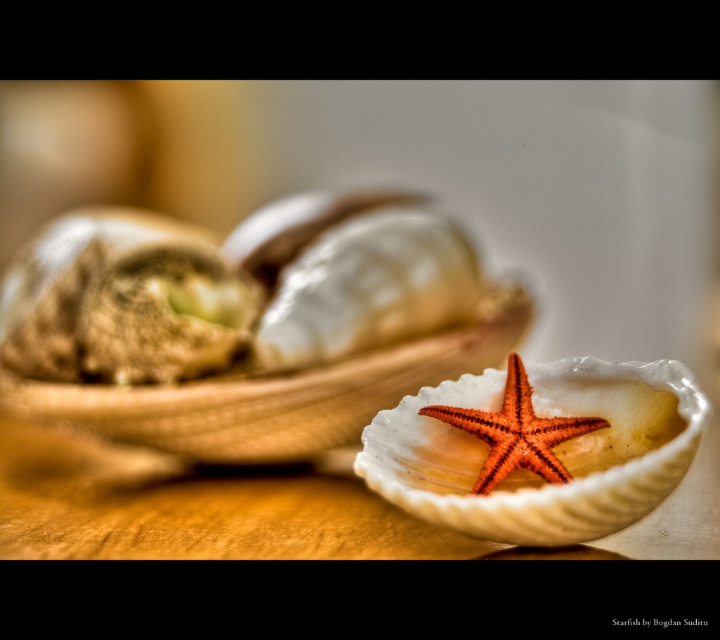
Question: Based on their relative distances, which object is nearer to the smooth white shell at center?

Choices:
 (A) orange matte starfish at center
 (B) white matte shellfish at center

Answer: (A)

Question: Which point is closer to the camera?

Choices:
 (A) (631, 444)
 (B) (18, 289)
 (C) (504, 461)

Answer: (C)

Question: Is white matte shellfish at center in front of orange matte starfish at center?

Choices:
 (A) yes
 (B) no

Answer: (B)

Question: Estimate the real-world distances between objects in this image. Which object is closer to the smooth white shell at center?

Choices:
 (A) orange matte starfish at center
 (B) white matte shellfish at center

Answer: (A)

Question: Does white matte shellfish at center appear on the right side of smooth white shell at center?

Choices:
 (A) no
 (B) yes

Answer: (A)

Question: Is white matte shellfish at center thinner than smooth white shell at center?

Choices:
 (A) yes
 (B) no

Answer: (B)